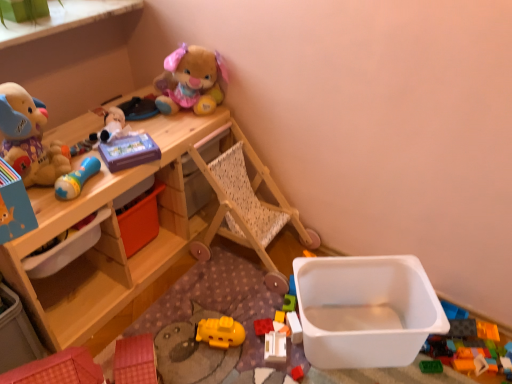
At what (x,y) coordinates should I click in order to perform the action: click on vacant area situated to the left side of yellow plastic toy at center, the 5th toy when ordered from top to bottom. Please return your answer as a coordinate pair (x, y). The width and height of the screenshot is (512, 384). Looking at the image, I should click on (244, 319).